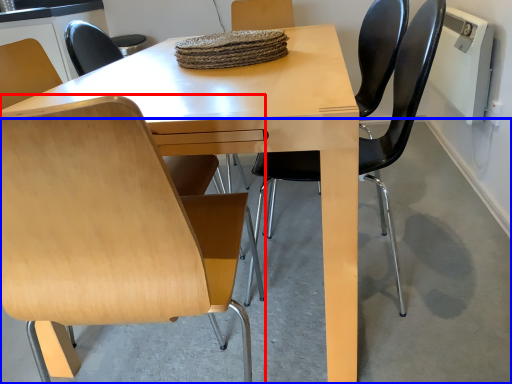
Question: Which point is closer to the camera, chair (highlighted by a red box) or concrete (highlighted by a blue box)?

Choices:
 (A) chair
 (B) concrete

Answer: (A)